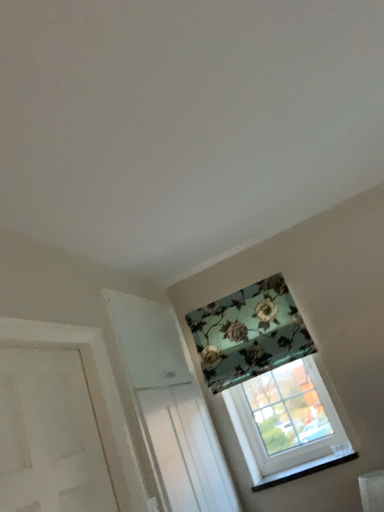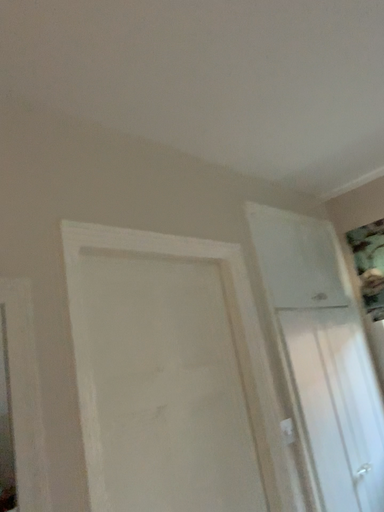
Question: Which way did the camera rotate in the video?

Choices:
 (A) rotated downward
 (B) rotated upward

Answer: (A)